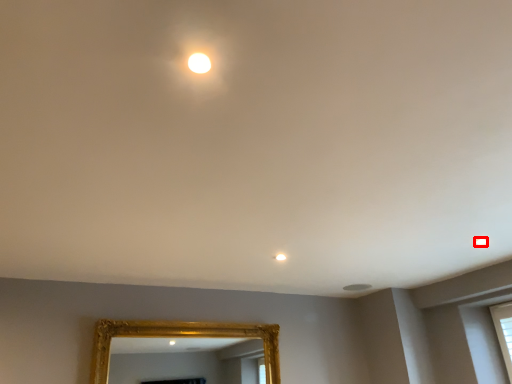
Question: Observing the image, what is the correct spatial positioning of light (annotated by the red box) in reference to mirror?

Choices:
 (A) left
 (B) right

Answer: (B)